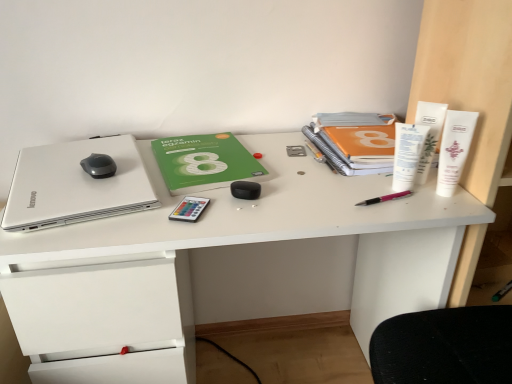
At what (x,y) coordinates should I click in order to perform the action: click on vacant space in front of black rubberized mouse at upper left. Please return your answer as a coordinate pair (x, y). This screenshot has height=384, width=512. Looking at the image, I should click on [71, 194].